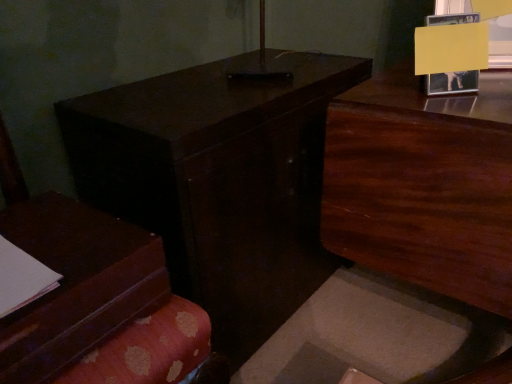
Question: Is matte brown book at left far away from dark wood dresser at upper right?

Choices:
 (A) no
 (B) yes

Answer: (A)

Question: Is matte brown book at left shorter than dark wood dresser at upper right?

Choices:
 (A) no
 (B) yes

Answer: (B)

Question: Is matte brown book at left turned away from dark wood dresser at upper right?

Choices:
 (A) no
 (B) yes

Answer: (A)

Question: From the image's perspective, is matte brown book at left located above dark wood dresser at upper right?

Choices:
 (A) no
 (B) yes

Answer: (A)

Question: From the image's perspective, would you say matte brown book at left is shown under dark wood dresser at upper right?

Choices:
 (A) yes
 (B) no

Answer: (A)

Question: In terms of height, does dark wood table at center look taller or shorter compared to matte brown book at left?

Choices:
 (A) short
 (B) tall

Answer: (B)

Question: Does point (203, 66) appear closer or farther from the camera than point (34, 244)?

Choices:
 (A) closer
 (B) farther

Answer: (B)

Question: Considering the positions of dark wood table at center and matte brown book at left in the image, is dark wood table at center bigger or smaller than matte brown book at left?

Choices:
 (A) big
 (B) small

Answer: (A)

Question: From a real-world perspective, relative to matte brown book at left, is dark wood table at center vertically above or below?

Choices:
 (A) above
 (B) below

Answer: (B)

Question: From the image's perspective, is dark wood dresser at upper right above or below dark wood table at center?

Choices:
 (A) below
 (B) above

Answer: (A)

Question: Do you think dark wood dresser at upper right is within dark wood table at center, or outside of it?

Choices:
 (A) inside
 (B) outside

Answer: (B)

Question: Is dark wood dresser at upper right taller or shorter than dark wood table at center?

Choices:
 (A) short
 (B) tall

Answer: (B)

Question: Is dark wood dresser at upper right bigger or smaller than dark wood table at center?

Choices:
 (A) small
 (B) big

Answer: (A)

Question: Considering their positions, is dark wood table at center located in front of or behind dark wood dresser at upper right?

Choices:
 (A) behind
 (B) front

Answer: (A)

Question: From the image's perspective, relative to dark wood dresser at upper right, is dark wood table at center above or below?

Choices:
 (A) above
 (B) below

Answer: (A)